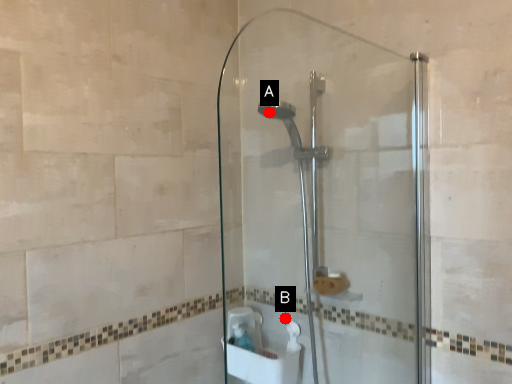
Question: Two points are circled on the image, labeled by A and B beside each circle. Among these points, which one is nearest to the camera?

Choices:
 (A) A is closer
 (B) B is closer

Answer: (A)